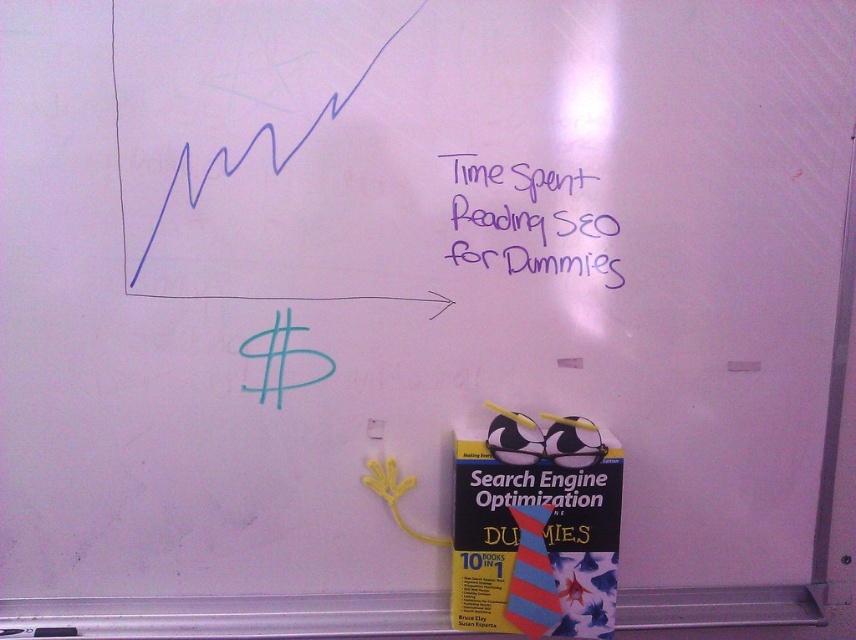
You are an interior designer assessing the placement of the purple marker writing at upper right and the yellow fabric tie at lower right in the image. Which object is taller?

The purple marker writing at upper right is taller than the yellow fabric tie at lower right.

Looking at this image, you are standing in front of the whiteboard and notice the purple marker writing at upper right. Can you determine its exact position on the whiteboard using coordinates?

The purple marker writing at upper right is located at point 0.344 on the x and 0.623 on the y axis.